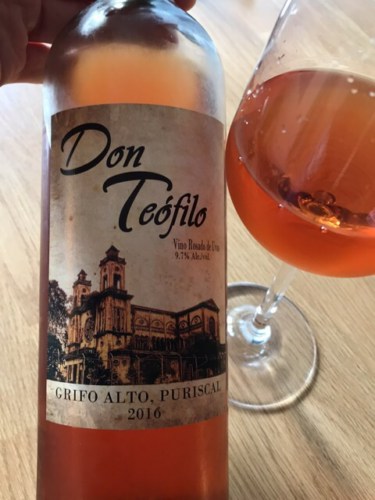
Locate an element on the screen. glass is located at coordinates (x=322, y=46).